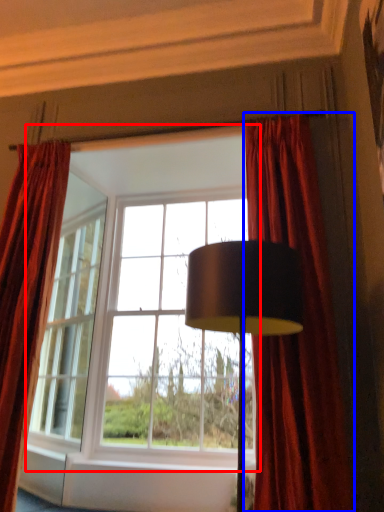
Question: Which of the following is the closest to the observer, window (highlighted by a red box) or curtain (highlighted by a blue box)?

Choices:
 (A) window
 (B) curtain

Answer: (B)